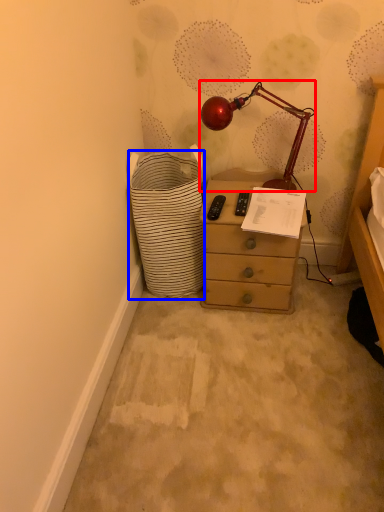
Question: Which point is closer to the camera, lamp (highlighted by a red box) or shopping basket (highlighted by a blue box)?

Choices:
 (A) lamp
 (B) shopping basket

Answer: (B)